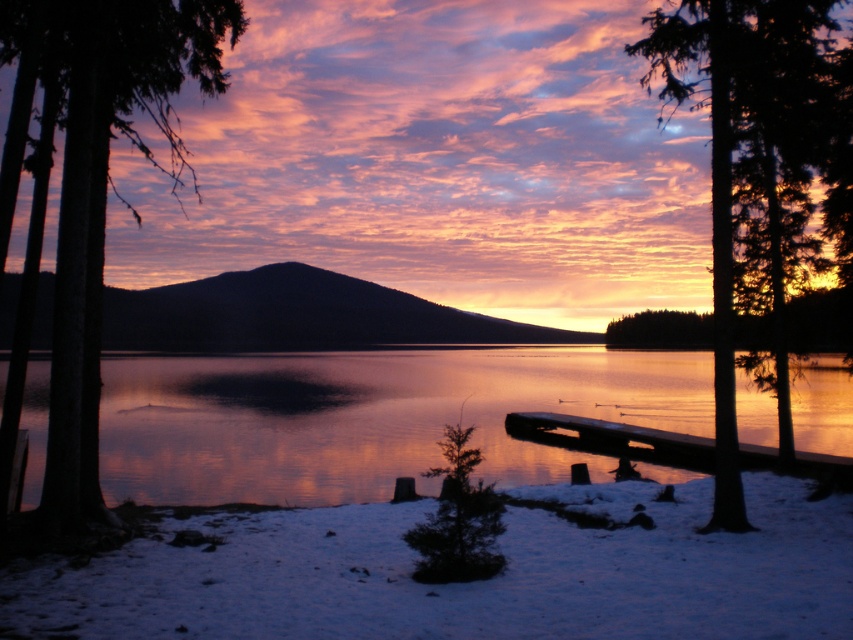
You are standing at the edge of the wooden dock at lower right and want to look towards the green matte tree at upper right. In which direction should you turn your head?

The green matte tree at upper right is positioned on the right side of the wooden dock at lower right, so you should turn your head to the right to look towards the green matte tree at upper right.

You are standing on the dock and want to take a photo of both the glistening water at center and the smooth bark tree at left. Which object should you frame first in your camera to ensure both are in the shot?

You should frame the smooth bark tree at left first because the glistening water at center is positioned on its right side, so by starting with the tree, you can adjust the camera to include both objects in the frame.

You are standing on the wooden dock at lower right and want to take a photo of the smooth bark tree at left. Considering their heights, which object should you position closer to the camera to ensure the tree appears larger in the photo?

The smooth bark tree at left is much taller than the wooden dock at lower right. To make the tree appear larger in the photo, you should position yourself closer to the smooth bark tree at left while taking the picture.